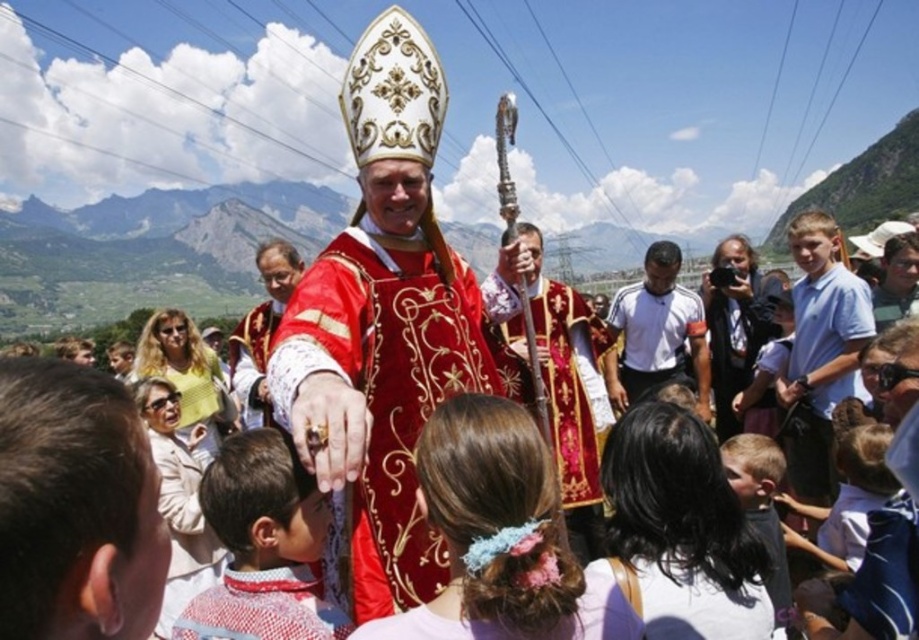
Question: Which object is farther from the camera taking this photo?

Choices:
 (A) light brown hair at lower right
 (B) matte white robe at center
 (C) gold embroidered robe at center
 (D) white athletic shirt at center

Answer: (D)

Question: Is matte gold vestment at center wider than light brown hair at lower right?

Choices:
 (A) yes
 (B) no

Answer: (A)

Question: Is white athletic shirt at center below light brown hair at lower right?

Choices:
 (A) yes
 (B) no

Answer: (B)

Question: Which point is farther from the camera taking this photo?

Choices:
 (A) (246, 365)
 (B) (652, 336)
 (C) (321, 620)
 (D) (790, 592)

Answer: (B)

Question: From the image, what is the correct spatial relationship of matte gold vestment at center in relation to gold embroidered robe at center?

Choices:
 (A) left
 (B) right

Answer: (A)

Question: Which point is closer to the camera?

Choices:
 (A) matte gold vestment at center
 (B) light blue cotton shirt at right
 (C) gold embroidered robe at center

Answer: (A)